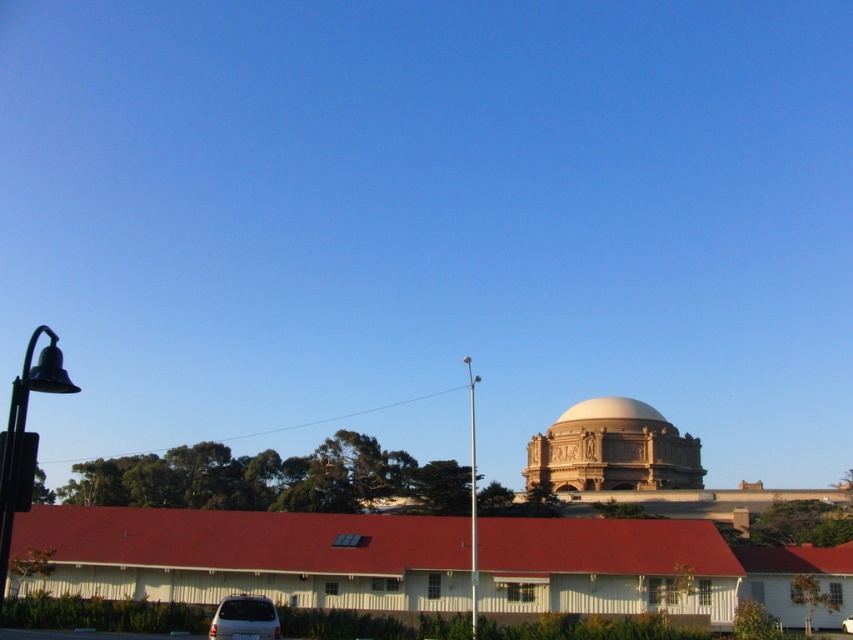
Question: Which object is farther from the camera taking this photo?

Choices:
 (A) white smooth dome at center
 (B) white matte van at lower center

Answer: (A)

Question: Is black metal bell at left in front of white metallic pole at center?

Choices:
 (A) no
 (B) yes

Answer: (B)

Question: Is white smooth dome at center to the left of white metallic pole at center from the viewer's perspective?

Choices:
 (A) yes
 (B) no

Answer: (B)

Question: Which object appears farthest from the camera in this image?

Choices:
 (A) golden stone dome at center
 (B) black metal bell at left

Answer: (A)

Question: Estimate the real-world distances between objects in this image. Which object is closer to the black metal bell at left?

Choices:
 (A) white smooth dome at center
 (B) white metallic pole at center
 (C) golden stone dome at center
 (D) white matte van at lower center

Answer: (D)

Question: Does black metal bell at left have a greater width compared to white matte van at lower center?

Choices:
 (A) yes
 (B) no

Answer: (A)